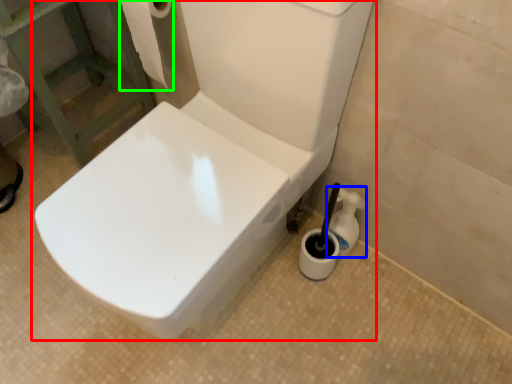
Question: Based on their relative distances, which object is nearer to toilet (highlighted by a red box)? Choose from cleaning product (highlighted by a blue box) and toilet paper (highlighted by a green box).

Choices:
 (A) cleaning product
 (B) toilet paper

Answer: (A)